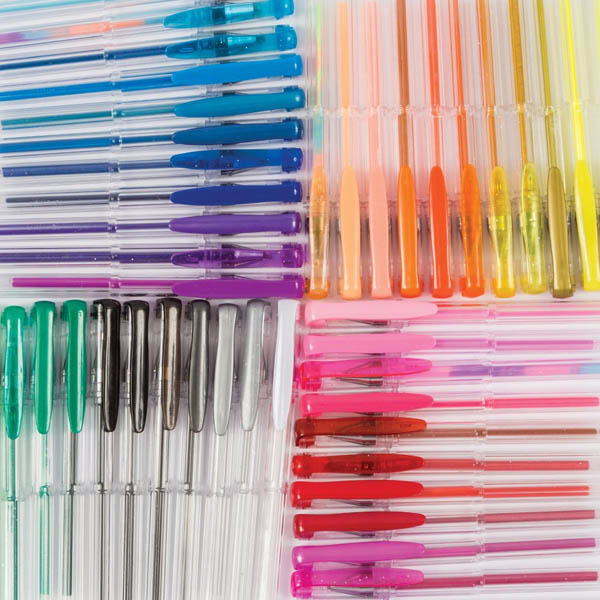
The image size is (600, 600). Identify the location of pens with caps pointing upwards. (13, 397), (50, 382), (76, 382), (113, 380), (140, 381), (172, 382), (196, 382), (226, 384), (255, 384).